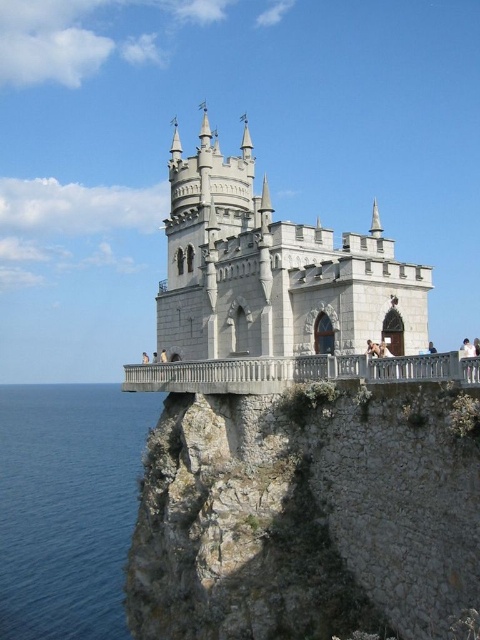
Question: Is the position of gray rocky cliff at center less distant than that of white stone castle at center?

Choices:
 (A) no
 (B) yes

Answer: (B)

Question: Is gray rocky cliff at center positioned in front of blue water at lower left?

Choices:
 (A) yes
 (B) no

Answer: (A)

Question: Estimate the real-world distances between objects in this image. Which object is farther from the white stone castle at center?

Choices:
 (A) blue water at lower left
 (B) gray rocky cliff at center

Answer: (A)

Question: Estimate the real-world distances between objects in this image. Which object is closer to the gray rocky cliff at center?

Choices:
 (A) blue water at lower left
 (B) white stone castle at center

Answer: (B)

Question: Among these objects, which one is nearest to the camera?

Choices:
 (A) blue water at lower left
 (B) gray rocky cliff at center

Answer: (B)

Question: Does gray rocky cliff at center have a greater width compared to white stone castle at center?

Choices:
 (A) yes
 (B) no

Answer: (B)